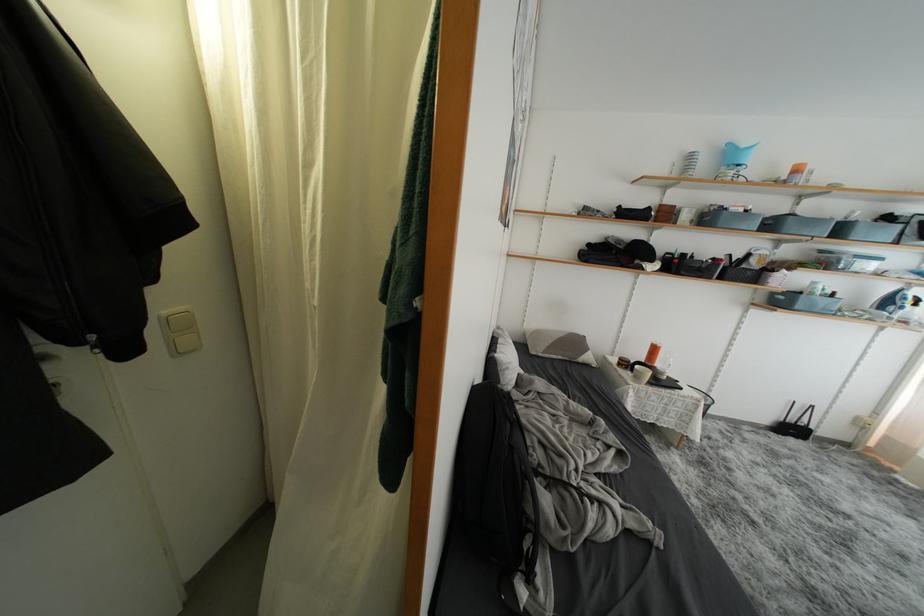
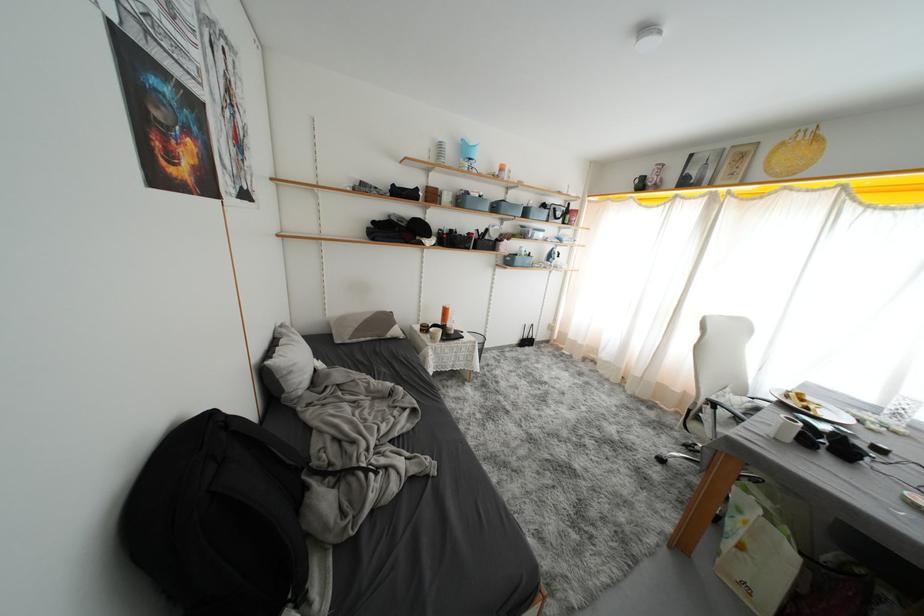
Question: How did the camera likely rotate?

Choices:
 (A) Left
 (B) Right
 (C) Up
 (D) Down

Answer: (B)